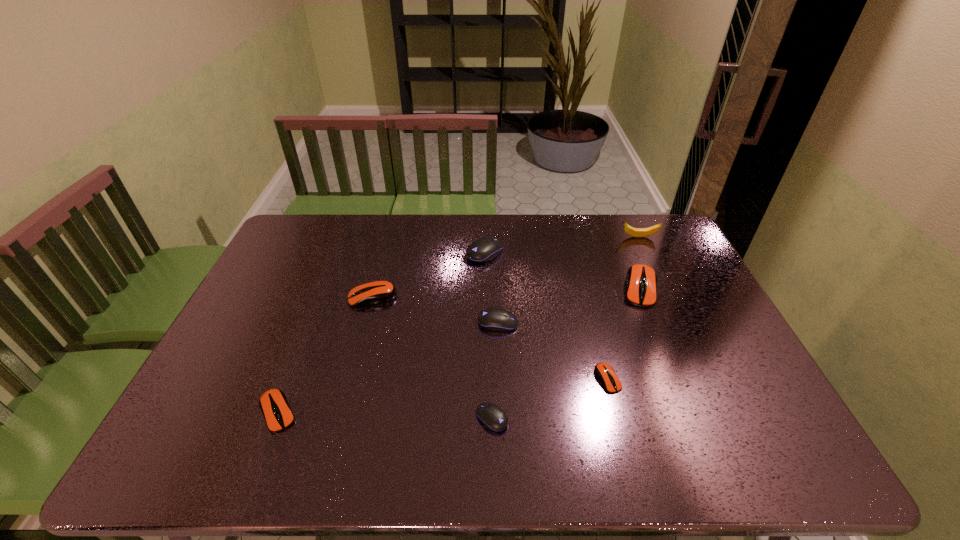
The image size is (960, 540). Identify the location of free spot between the nearest black computer mouse and the farthest object. (565, 328).

Identify the location of unoccupied position between the leftmost computer mouse and the sixth object from left to right. (443, 396).

At what (x,y) coordinates should I click in order to perform the action: click on free space between the leftmost computer mouse and the fourth nearest computer mouse. Please return your answer as a coordinate pair (x, y). The height and width of the screenshot is (540, 960). Looking at the image, I should click on click(388, 368).

Identify the location of vacant area that lies between the second farthest black computer mouse and the farthest object. Image resolution: width=960 pixels, height=540 pixels. (568, 280).

Identify the location of blank region between the rightmost computer mouse and the biggest black computer mouse. (562, 271).

Identify the location of empty location between the nearest black computer mouse and the leftmost orange computer mouse. This screenshot has height=540, width=960. (385, 415).

Find the location of a particular element. This screenshot has height=540, width=960. vacant point located between the nearest black computer mouse and the second orange computer mouse from left to right is located at coordinates (432, 358).

Identify the location of the sixth closest object to the banana. The width and height of the screenshot is (960, 540). (493, 417).

The image size is (960, 540). I want to click on object that is the sixth nearest to the leftmost orange computer mouse, so (641, 280).

You are a GUI agent. You are given a task and a screenshot of the screen. Output one action in this format:
    pyautogui.click(x=<x>, y=<y>)
    Task: Click on the computer mouse that stands as the seventh closest to the farthest object
    This screenshot has height=540, width=960.
    Given the screenshot: What is the action you would take?
    pyautogui.click(x=273, y=403)